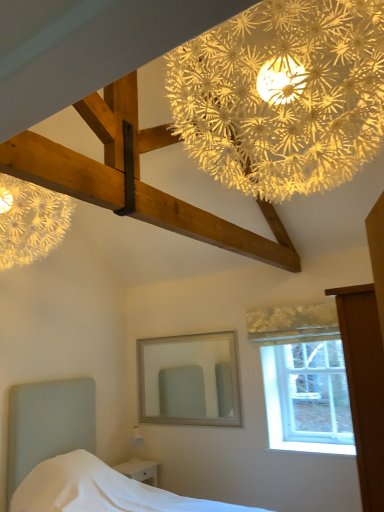
Question: Considering the relative positions of illuminated paper flower at upper center and white fabric bed at lower left in the image provided, is illuminated paper flower at upper center behind white fabric bed at lower left?

Choices:
 (A) yes
 (B) no

Answer: (B)

Question: Considering the relative positions of illuminated paper flower at upper center and white fabric bed at lower left in the image provided, is illuminated paper flower at upper center to the right of white fabric bed at lower left from the viewer's perspective?

Choices:
 (A) no
 (B) yes

Answer: (B)

Question: Can you confirm if illuminated paper flower at upper center is wider than white fabric bed at lower left?

Choices:
 (A) yes
 (B) no

Answer: (B)

Question: Can you confirm if illuminated paper flower at upper center is smaller than white fabric bed at lower left?

Choices:
 (A) yes
 (B) no

Answer: (A)

Question: Does illuminated paper flower at upper center appear on the left side of white fabric bed at lower left?

Choices:
 (A) no
 (B) yes

Answer: (A)

Question: Considering the positions of white fabric bed at lower left and illuminated paper flower at upper center in the image, is white fabric bed at lower left bigger or smaller than illuminated paper flower at upper center?

Choices:
 (A) small
 (B) big

Answer: (B)

Question: From a real-world perspective, relative to illuminated paper flower at upper center, is white fabric bed at lower left vertically above or below?

Choices:
 (A) above
 (B) below

Answer: (B)

Question: From the image's perspective, is white fabric bed at lower left above or below illuminated paper flower at upper center?

Choices:
 (A) below
 (B) above

Answer: (A)

Question: Is white fabric bed at lower left wider or thinner than illuminated paper flower at upper center?

Choices:
 (A) wide
 (B) thin

Answer: (A)

Question: Does point (240, 161) appear closer or farther from the camera than point (196, 374)?

Choices:
 (A) closer
 (B) farther

Answer: (A)

Question: In terms of size, does illuminated paper flower at upper center appear bigger or smaller than white wooden mirror at center?

Choices:
 (A) small
 (B) big

Answer: (B)

Question: In terms of height, does illuminated paper flower at upper center look taller or shorter compared to white wooden mirror at center?

Choices:
 (A) short
 (B) tall

Answer: (B)

Question: From the image's perspective, is illuminated paper flower at upper center located above or below white wooden mirror at center?

Choices:
 (A) above
 (B) below

Answer: (A)

Question: Is clear glass window at upper right bigger or smaller than illuminated paper flower at upper center?

Choices:
 (A) big
 (B) small

Answer: (B)

Question: Considering the positions of clear glass window at upper right and illuminated paper flower at upper center in the image, is clear glass window at upper right taller or shorter than illuminated paper flower at upper center?

Choices:
 (A) short
 (B) tall

Answer: (A)